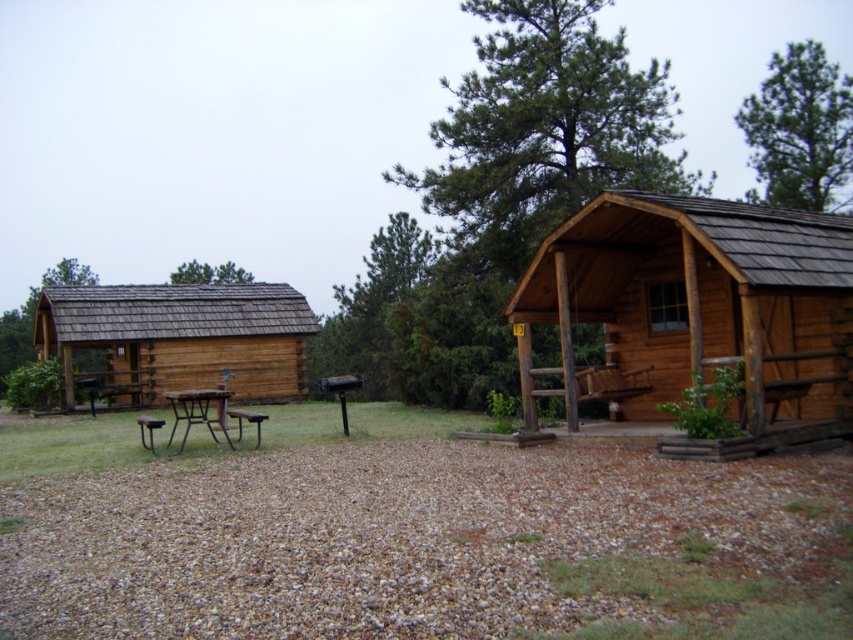
Describe the element at coordinates (178, 337) in the screenshot. I see `brown wooden hut at left` at that location.

Which is behind, point (135, 288) or point (177, 273)?

Positioned behind is point (177, 273).

Does point (68, 355) come closer to viewer compared to point (193, 269)?

Yes, it is in front of point (193, 269).

Locate an element on the screen. This screenshot has height=640, width=853. brown wooden hut at left is located at coordinates (178, 337).

Is point (523, 248) more distant than point (177, 452)?

Yes, it is.

Identify the location of green textured tree at upper center. (524, 177).

Is brown wooden cabin at right bigger than green shingles at upper center?

No.

Does brown wooden cabin at right appear on the right side of green shingles at upper center?

Yes, brown wooden cabin at right is to the right of green shingles at upper center.

Locate an element on the screen. This screenshot has width=853, height=640. brown wooden cabin at right is located at coordinates (698, 308).